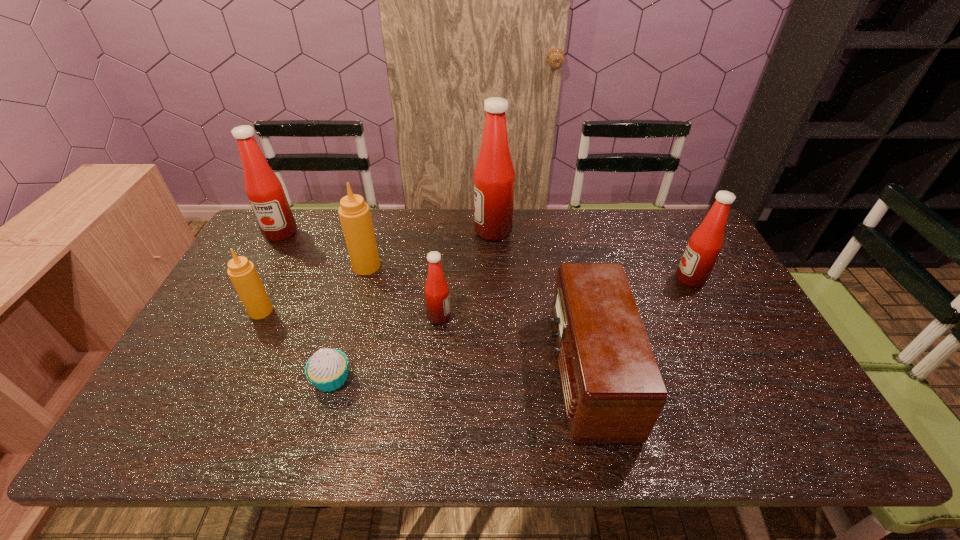
Locate an element on the screen. The width and height of the screenshot is (960, 540). vacant point that satisfies the following two spatial constraints: 1. on the front-facing side of the shortest object; 2. on the left side of the second tallest condiment is located at coordinates coord(202,379).

The image size is (960, 540). What are the coordinates of `free space that satisfies the following two spatial constraints: 1. on the front-facing side of the left tan condiment; 2. on the left side of the fifth shortest condiment` in the screenshot? It's located at (238, 311).